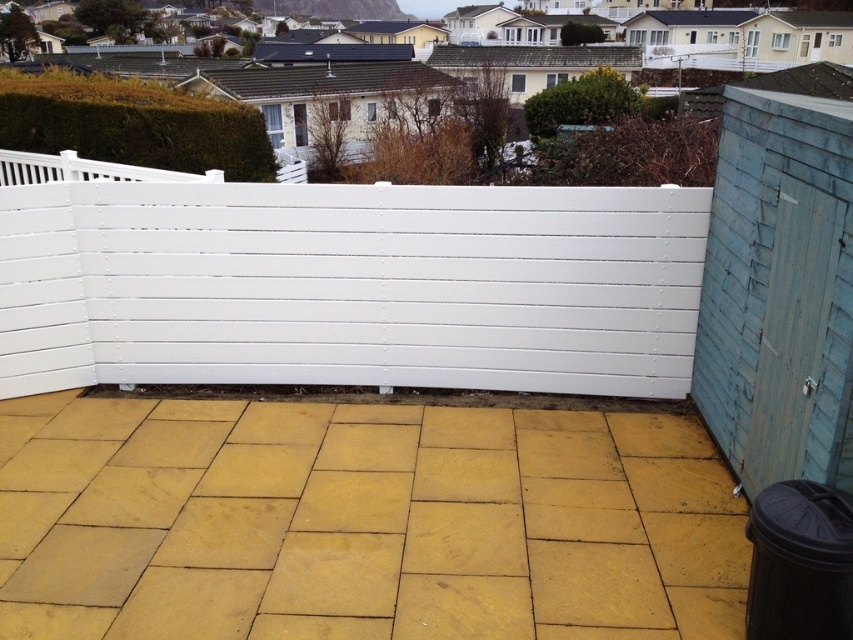
You are planning to place a large garden statue that requires a space wider than the blue wooden shed at right. Based on the scene, is there a suitable location on the yellow stone tiles at center to accommodate it?

The yellow stone tiles at center have a width larger than the blue wooden shed at right, so yes, the garden statue can be placed on the yellow stone tiles at center as it provides sufficient space.

You are a delivery drone flying over a residential area. You need to land on the blue wooden shed at right but must avoid the white painted wood fence at center. Based on the scene, can you safely land there?

The white painted wood fence at center is below the blue wooden shed at right, so the drone can safely land on the blue wooden shed at right without hitting the fence.

You are planning to install a new fence that is the same width as the yellow stone tiles at center. Based on the scene, will the new fence be narrower or wider than the existing white painted wood fence at center?

The yellow stone tiles at center are less in width than the white painted wood fence at center, so the new fence will be narrower than the existing white painted wood fence at center.